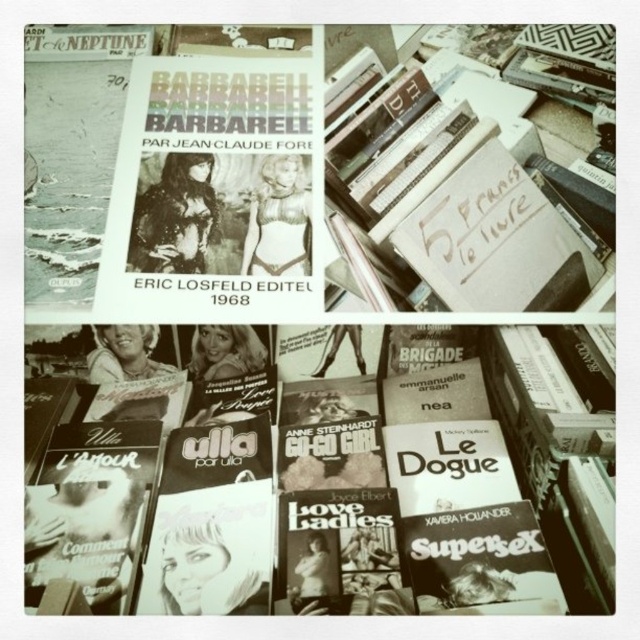
Question: Where is soft matte book at center located in relation to white paper sign at center in the image?

Choices:
 (A) left
 (B) right

Answer: (A)

Question: Which point is closer to the camera taking this photo?

Choices:
 (A) (477, 200)
 (B) (492, 566)

Answer: (B)

Question: Is soft matte book at center thinner than white paper sign at center?

Choices:
 (A) yes
 (B) no

Answer: (B)

Question: Which point is farther to the camera?

Choices:
 (A) (305, 500)
 (B) (340, 150)

Answer: (B)

Question: Which object appears closest to the camera in this image?

Choices:
 (A) white paper sign at center
 (B) soft matte book at center

Answer: (B)

Question: Can you confirm if soft matte book at center is wider than white paper sign at center?

Choices:
 (A) yes
 (B) no

Answer: (A)